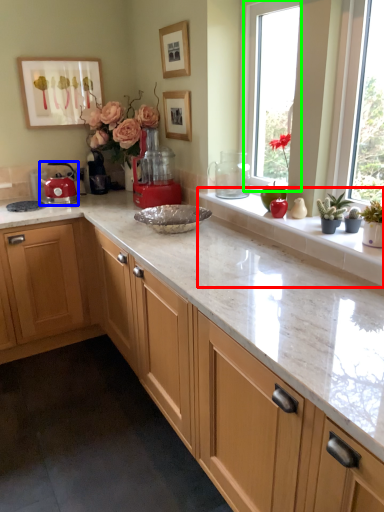
Question: Which is farther away from window sill (highlighted by a red box)? kitchen appliance (highlighted by a blue box) or window (highlighted by a green box)?

Choices:
 (A) kitchen appliance
 (B) window

Answer: (A)